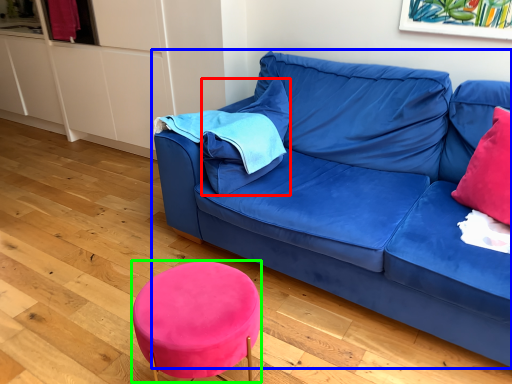
Question: Which object is positioned farthest from pillow (highlighted by a red box)? Select from studio couch (highlighted by a blue box) and bar stool (highlighted by a green box).

Choices:
 (A) studio couch
 (B) bar stool

Answer: (B)